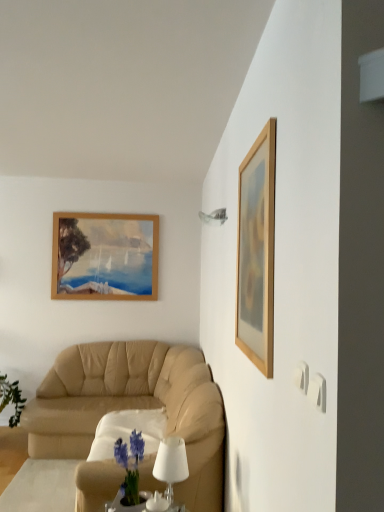
What is the approximate width of wooden picture frame at upper right?

It is 1.27 inches.

This screenshot has width=384, height=512. I want to click on beige leather couch at lower left, so [x=133, y=407].

This screenshot has width=384, height=512. I want to click on white matte table lamp at lower center, so click(x=171, y=464).

Considering the relative sizes of white matte table lamp at lower center and wooden picture frame at upper right in the image provided, is white matte table lamp at lower center shorter than wooden picture frame at upper right?

Correct, white matte table lamp at lower center is not as tall as wooden picture frame at upper right.

Based on their positions, is white matte table lamp at lower center located to the left or right of wooden picture frame at upper right?

white matte table lamp at lower center is to the left of wooden picture frame at upper right.

From a real-world perspective, is white matte table lamp at lower center on wooden picture frame at upper right?

No, from a real-world perspective, white matte table lamp at lower center is not over wooden picture frame at upper right

From the picture: Can you confirm if white matte table lamp at lower center is bigger than wooden picture frame at upper right?

No.

Could you tell me if white matte table lamp at lower center is turned towards beige leather couch at lower left?

No, white matte table lamp at lower center does not turn towards beige leather couch at lower left.

Is white matte table lamp at lower center taller than beige leather couch at lower left?

No.

Is white matte table lamp at lower center beside beige leather couch at lower left?

white matte table lamp at lower center and beige leather couch at lower left are clearly separated.

In the scene shown: Does white matte table lamp at lower center have a lesser width compared to beige leather couch at lower left?

Indeed, white matte table lamp at lower center has a lesser width compared to beige leather couch at lower left.

How much distance is there between beige leather couch at lower left and white matte table lamp at lower center?

1.88 meters.

Looking at the image, does beige leather couch at lower left seem bigger or smaller compared to white matte table lamp at lower center?

beige leather couch at lower left is bigger than white matte table lamp at lower center.

Can you confirm if beige leather couch at lower left is taller than white matte table lamp at lower center?

Correct, beige leather couch at lower left is much taller as white matte table lamp at lower center.

How different are the orientations of metallic glass lampshade at upper center and wooden picture frame at upper right in degrees?

There is a 0.83-degree angle between the facing directions of metallic glass lampshade at upper center and wooden picture frame at upper right.

Measure the distance from metallic glass lampshade at upper center to wooden picture frame at upper right.

They are 3.86 feet apart.

From the image's perspective, would you say metallic glass lampshade at upper center is positioned over wooden picture frame at upper right?

Indeed, from the image's perspective, metallic glass lampshade at upper center is shown above wooden picture frame at upper right.

Relative to wooden picture frame at upper right, is metallic glass lampshade at upper center in front or behind?

metallic glass lampshade at upper center is behind wooden picture frame at upper right.

Identify the location of lamp that is behind the wooden picture frame at upper right. The image size is (384, 512). (214, 217).

Is wooden picture frame at upper right thinner than metallic glass lampshade at upper center?

Yes.

Measure the distance from wooden picture frame at upper right to metallic glass lampshade at upper center.

wooden picture frame at upper right is 1.18 meters away from metallic glass lampshade at upper center.

Are wooden picture frame at upper right and metallic glass lampshade at upper center making contact?

No, wooden picture frame at upper right is not with metallic glass lampshade at upper center.

Does beige leather couch at lower left turn towards metallic glass lampshade at upper center?

No.

Is beige leather couch at lower left bigger than metallic glass lampshade at upper center?

Yes.

You are a GUI agent. You are given a task and a screenshot of the screen. Output one action in this format:
    pyautogui.click(x=<x>, y=<y>)
    Task: Click on the studio couch on the left of metallic glass lampshade at upper center
    The height and width of the screenshot is (512, 384).
    Given the screenshot: What is the action you would take?
    pyautogui.click(x=133, y=407)

From a real-world perspective, which is physically above, metallic glass lampshade at upper center or white matte table lamp at lower center?

In real-world perspective, metallic glass lampshade at upper center is above.

Would you say white matte table lamp at lower center is part of metallic glass lampshade at upper center's contents?

Definitely not — white matte table lamp at lower center is not inside metallic glass lampshade at upper center.

Is metallic glass lampshade at upper center aimed at white matte table lamp at lower center?

No, metallic glass lampshade at upper center is not turned towards white matte table lamp at lower center.

Locate an element on the screen. table lamp on the left of metallic glass lampshade at upper center is located at coordinates (x=171, y=464).

Locate an element on the screen. picture frame that is on the right side of white matte table lamp at lower center is located at coordinates (257, 251).

Find the location of a particular element. The height and width of the screenshot is (512, 384). table lamp that is above the beige leather couch at lower left (from a real-world perspective) is located at coordinates (171, 464).

From the image, which object appears to be farther from beige leather couch at lower left, wooden picture frame at upper right or white matte table lamp at lower center?

Among the two, wooden picture frame at upper right is located further to beige leather couch at lower left.

Estimate the real-world distances between objects in this image. Which object is closer to white matte table lamp at lower center, wooden picture frame at upper right or metallic glass lampshade at upper center?

wooden picture frame at upper right.

Which object lies nearer to the anchor point wooden picture frame at upper right, beige leather couch at lower left or white matte table lamp at lower center?

The object closer to wooden picture frame at upper right is white matte table lamp at lower center.

Which object lies nearer to the anchor point wooden picture frame at upper right, metallic glass lampshade at upper center or white matte table lamp at lower center?

white matte table lamp at lower center.

Based on their spatial positions, is wooden picture frame at upper right or beige leather couch at lower left closer to white matte table lamp at lower center?

wooden picture frame at upper right is closer to white matte table lamp at lower center.

Looking at the image, which one is located further to beige leather couch at lower left, white matte table lamp at lower center or wooden picture frame at upper right?

Based on the image, wooden picture frame at upper right appears to be further to beige leather couch at lower left.

When comparing their distances from metallic glass lampshade at upper center, does wooden picture frame at upper right or white matte table lamp at lower center seem further?

Among the two, white matte table lamp at lower center is located further to metallic glass lampshade at upper center.

Looking at the image, which one is located closer to metallic glass lampshade at upper center, white matte table lamp at lower center or beige leather couch at lower left?

white matte table lamp at lower center is positioned closer to the anchor metallic glass lampshade at upper center.

I want to click on table lamp that lies between metallic glass lampshade at upper center and beige leather couch at lower left from top to bottom, so click(x=171, y=464).

Where is `table lamp between wooden picture frame at upper right and beige leather couch at lower left from top to bottom`? The height and width of the screenshot is (512, 384). table lamp between wooden picture frame at upper right and beige leather couch at lower left from top to bottom is located at coordinates (171, 464).

You are a GUI agent. You are given a task and a screenshot of the screen. Output one action in this format:
    pyautogui.click(x=<x>, y=<y>)
    Task: Click on the picture frame between metallic glass lampshade at upper center and white matte table lamp at lower center in the vertical direction
    
    Given the screenshot: What is the action you would take?
    pyautogui.click(x=257, y=251)

At what (x,y) coordinates should I click in order to perform the action: click on picture frame between metallic glass lampshade at upper center and beige leather couch at lower left vertically. Please return your answer as a coordinate pair (x, y). The width and height of the screenshot is (384, 512). Looking at the image, I should click on (257, 251).